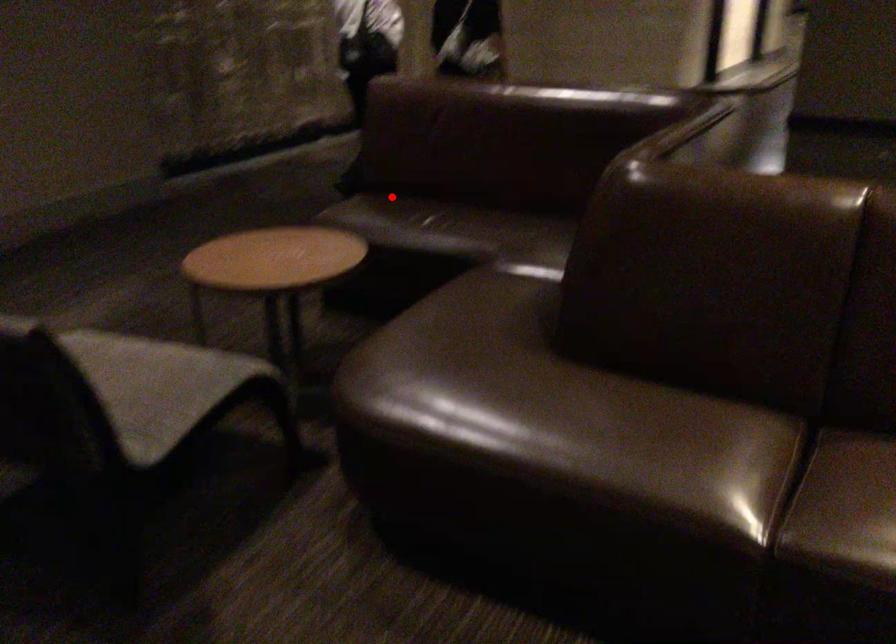
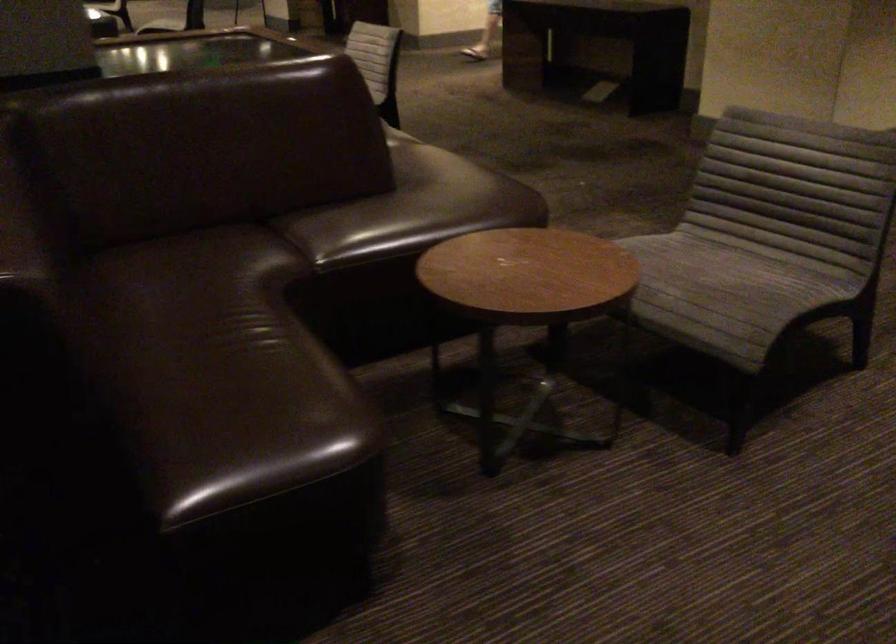
Question: I am providing you with two images of the same scene from different viewpoints. In image1, a red point is highlighted. Considering the same 3D point in image2, which of the following is correct?

Choices:
 (A) It is closer
 (B) It is farther

Answer: (A)